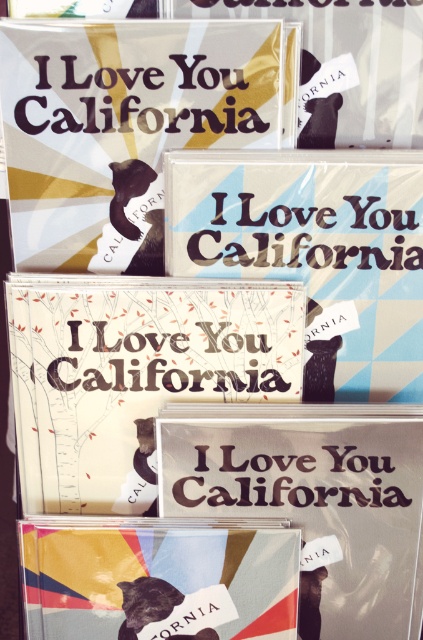
You are standing in front of the CD cases and want to touch the point at the lower position. Which point should you choose between point (255, 321) and point (310, 292)?

Point (255, 321) is lower than point (310, 292) because it has a smaller y coordinate value.

From the picture: You are organizing a display and need to ensure that both the matte paper card at center and the blue paper poster at center are visible. Based on their positions, which object should be moved to the front to achieve this?

The blue paper poster at center is currently behind the matte paper card at center. To make both visible, move the blue paper poster at center in front of the matte paper card at center.